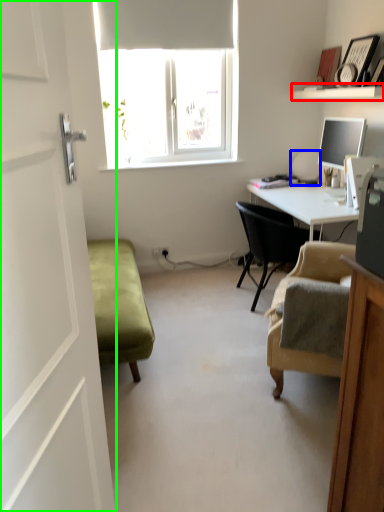
Question: Which object is positioned farthest from shelf (highlighted by a red box)? Select from table lamp (highlighted by a blue box) and screen door (highlighted by a green box).

Choices:
 (A) table lamp
 (B) screen door

Answer: (B)